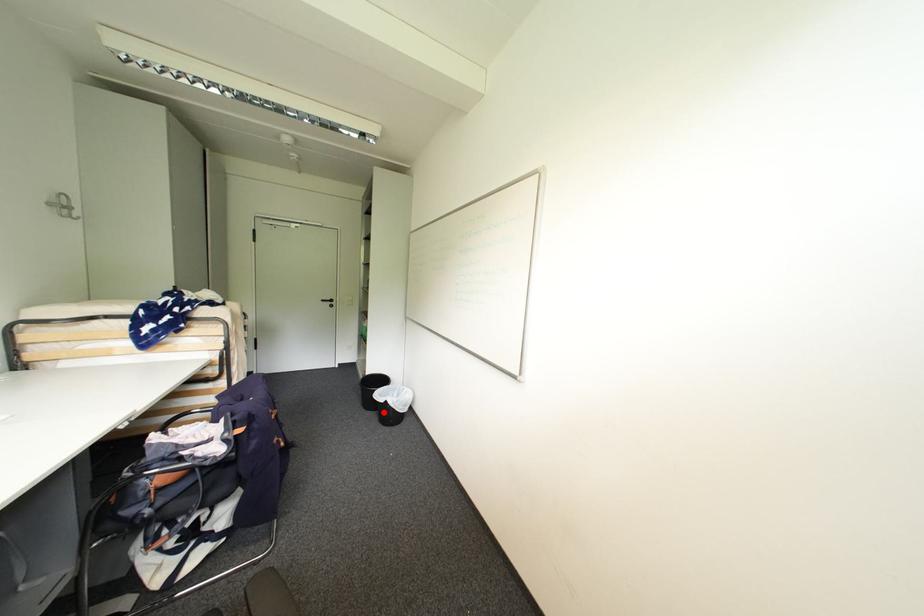
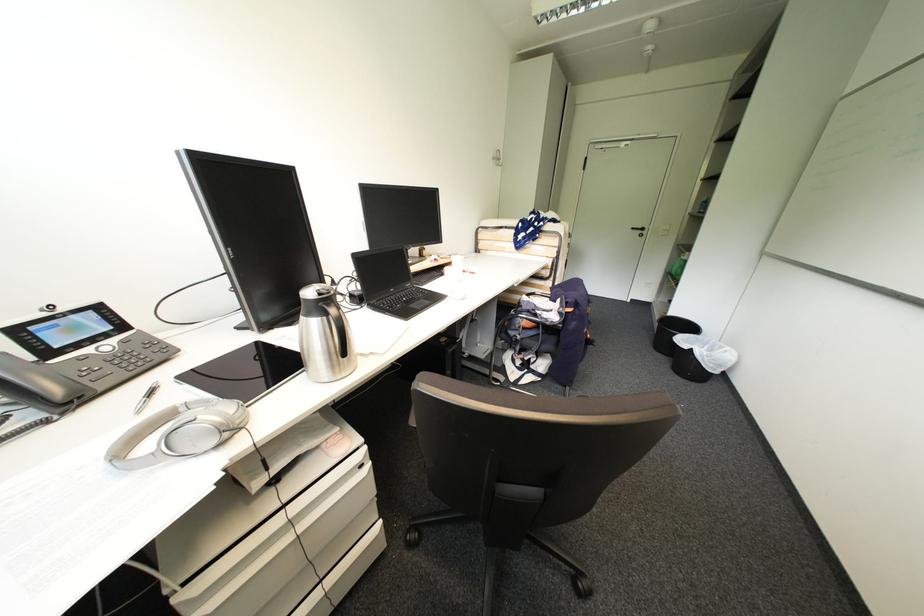
Question: I am providing you with two images of the same scene from different viewpoints. In image1, a red point is highlighted. Considering the same 3D point in image2, which of the following is correct?

Choices:
 (A) It is closer
 (B) It is farther

Answer: (A)